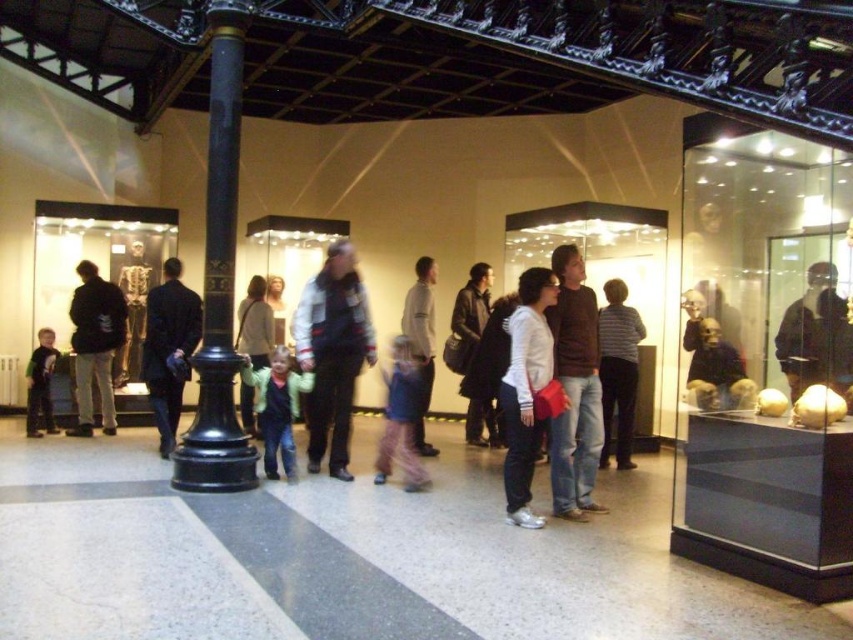
Does dark gray jacket at left appear under gold metallic skeleton at center?

Yes, dark gray jacket at left is below gold metallic skeleton at center.

Does dark gray jacket at left have a larger size compared to gold metallic skeleton at center?

Correct, dark gray jacket at left is larger in size than gold metallic skeleton at center.

Between point (96, 321) and point (126, 301), which one is positioned in front?

Point (96, 321) is more forward.

Locate an element on the screen. dark gray jacket at left is located at coordinates (96, 346).

Is point (276, 369) in front of point (263, 288)?

Yes, point (276, 369) is closer to viewer.

Does light green fleece jacket at center appear over light brown leather jacket at center?

Incorrect, light green fleece jacket at center is not positioned above light brown leather jacket at center.

Is point (280, 452) farther from camera compared to point (262, 365)?

That is False.

The height and width of the screenshot is (640, 853). I want to click on light green fleece jacket at center, so point(276,406).

Can you confirm if shiny silver helmet at upper right is taller than light green fleece jacket at center?

No.

Is point (778, 353) positioned after point (286, 426)?

No, it is not.

Where is `shiny silver helmet at upper right`? The image size is (853, 640). shiny silver helmet at upper right is located at coordinates (816, 336).